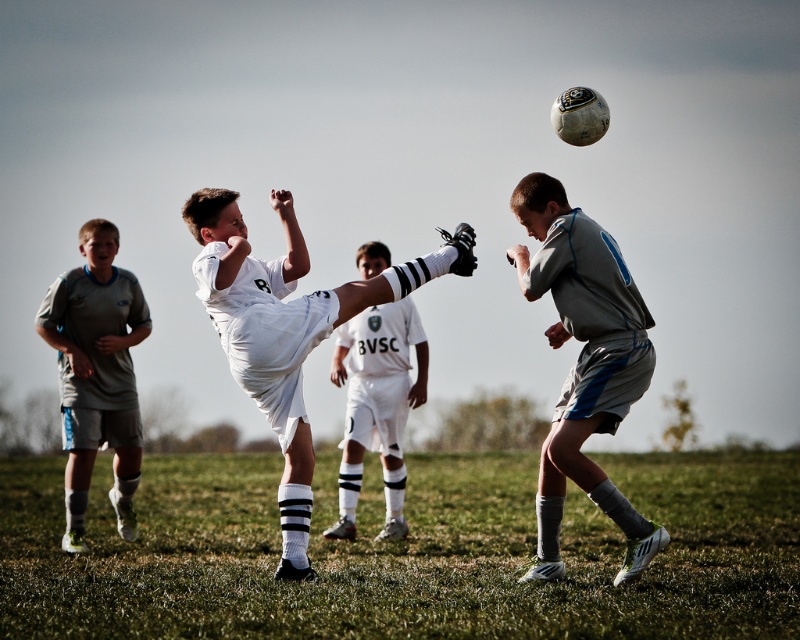
You are a soccer coach observing the match and want to analyze the positions of the white matte soccer ball at upper center and the gray matte shorts at left. Which object is nearer to you as you watch the game?

The white matte soccer ball at upper center is closer to the viewer than the gray matte shorts at left.

You are a soccer coach observing the match. You notice the white matte soccer ball at upper center and the gray matte shorts at left. Which object appears bigger in the image?

The white matte soccer ball at upper center appears larger than the gray matte shorts at left in the image.

Based on the photo, you are a soccer coach observing the match. You notice the white matte soccer ball at upper center and the gray matte shorts at left. Which object is positioned lower in the image?

The white matte soccer ball at upper center has a lesser height compared to gray matte shorts at left, so it is positioned lower in the image.